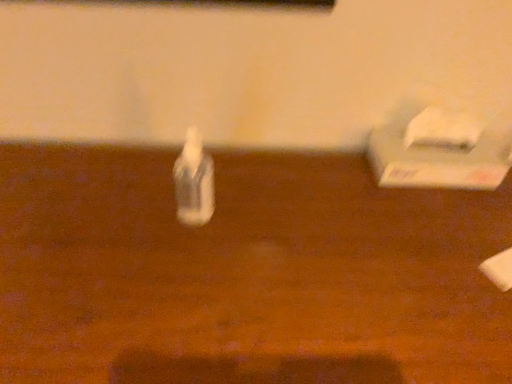
Image resolution: width=512 pixels, height=384 pixels. Identify the location of vacant space to the left of transparent plastic bottle at center. (97, 207).